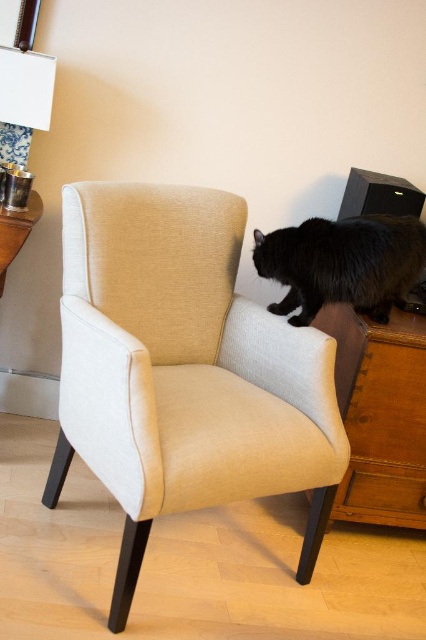
You are standing in front of the beige upholstered armchair and want to place a small object on the closest point between point (299, 436) and point (400, 369). Which point should you choose?

You should choose point (299, 436) because it is closer to the camera than point (400, 369).

You are trying to decide where to place a new plant that is 1 meter tall. You have two options in the scene shown. The first option is next to the brown wooden dresser at lower right, and the second option is next to the black fluffy cat on the right. Considering the size of the objects, which location would provide enough space for the plant?

The brown wooden dresser at lower right has a larger size compared to the black fluffy cat on the right, so placing the plant next to the brown wooden dresser at lower right would provide more space for the plant to fit comfortably.

You are trying to place a small plant between the beige fabric swivel chair at center and the black fluffy cat on the right. Based on their positions, where should you place the plant to ensure it is between them?

The beige fabric swivel chair at center is positioned on the left side of the black fluffy cat on the right, so you should place the plant between them to the right of the beige fabric swivel chair at center and to the left of the black fluffy cat on the right.